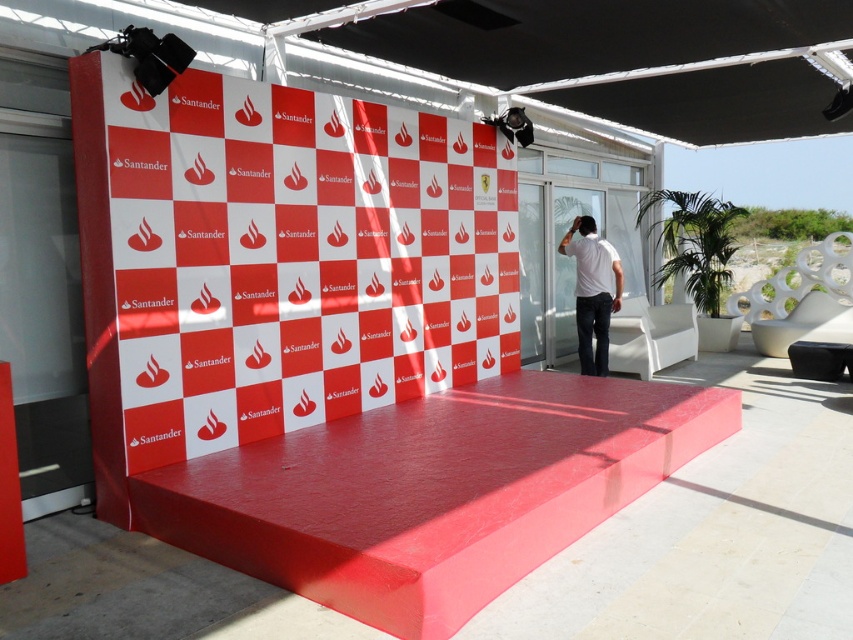
Question: Which point is farther to the camera?

Choices:
 (A) matte white canopy at upper center
 (B) smooth red ramp at center
 (C) white matte shirt at center

Answer: (C)

Question: Is matte white canopy at upper center below white matte shirt at center?

Choices:
 (A) no
 (B) yes

Answer: (A)

Question: Is smooth red ramp at center above matte white canopy at upper center?

Choices:
 (A) yes
 (B) no

Answer: (B)

Question: Which of the following is the farthest from the observer?

Choices:
 (A) matte white canopy at upper center
 (B) smooth red ramp at center
 (C) white matte shirt at center

Answer: (C)

Question: Which object is closer to the camera taking this photo?

Choices:
 (A) white matte shirt at center
 (B) matte white canopy at upper center

Answer: (B)

Question: Can you confirm if smooth red ramp at center is wider than white matte shirt at center?

Choices:
 (A) yes
 (B) no

Answer: (A)